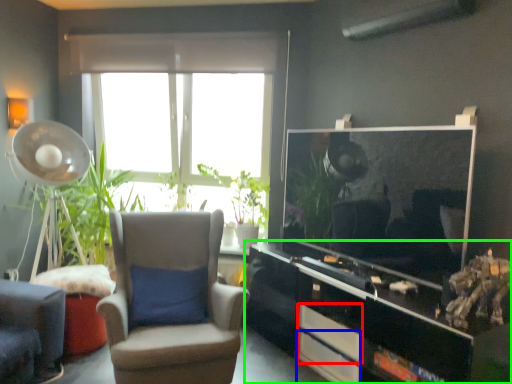
Question: Based on their relative distances, which object is nearer to drawer (highlighted by a red box)? Choose from drawer (highlighted by a blue box) and cabinetry (highlighted by a green box).

Choices:
 (A) drawer
 (B) cabinetry

Answer: (A)